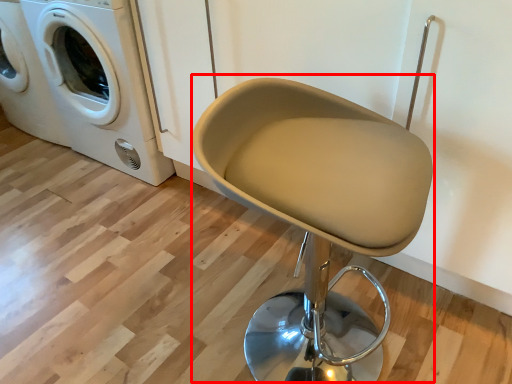
Question: Where is swivel chair (annotated by the red box) located in relation to washing machine in the image?

Choices:
 (A) right
 (B) left

Answer: (A)